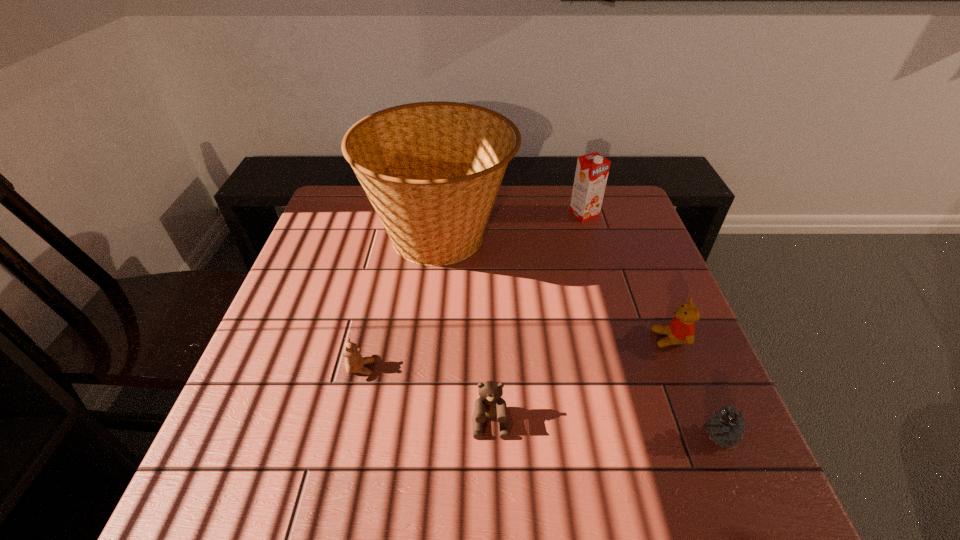
Where is `basket`? Image resolution: width=960 pixels, height=540 pixels. basket is located at coordinates (432, 170).

The image size is (960, 540). I want to click on the fifth shortest object, so click(592, 169).

I want to click on carton, so click(592, 169).

Find the location of a particular element. the rightmost teddy bear is located at coordinates (681, 330).

This screenshot has height=540, width=960. I want to click on the nearest teddy bear, so click(490, 405).

The height and width of the screenshot is (540, 960). Find the location of `the shortest teddy bear`. the shortest teddy bear is located at coordinates (354, 362).

Find the location of a particular element. This screenshot has height=540, width=960. pinecone is located at coordinates (726, 428).

This screenshot has width=960, height=540. In order to click on vacant region located 0.220m on the right of the tallest object in this screenshot , I will do `click(589, 237)`.

Locate an element on the screen. free space located 0.130m on the front of the fourth object from left to right is located at coordinates (595, 249).

Locate an element on the screen. The height and width of the screenshot is (540, 960). vacant region located on the front-facing side of the rightmost teddy bear is located at coordinates click(558, 339).